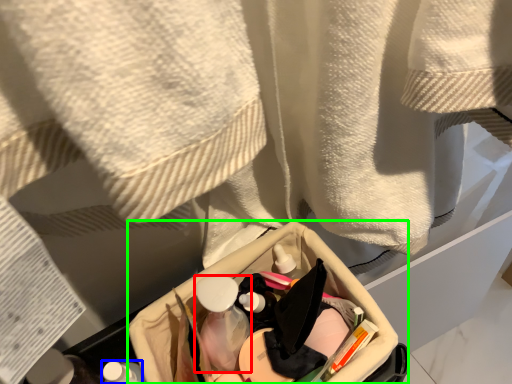
Question: Which object is the closest to the mouthwash (highlighted by a red box)? Choose among these: toiletry (highlighted by a blue box) or storage box (highlighted by a green box).

Choices:
 (A) toiletry
 (B) storage box

Answer: (B)